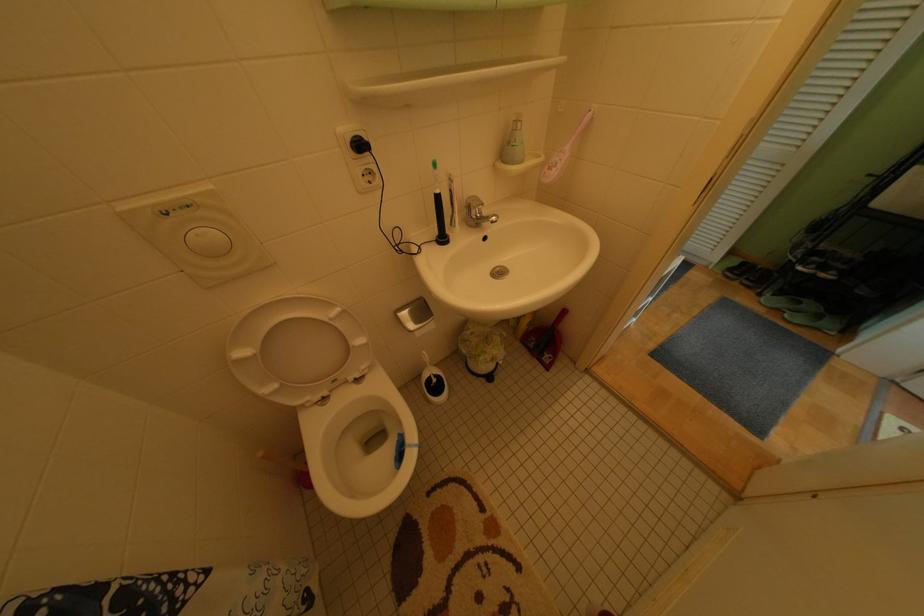
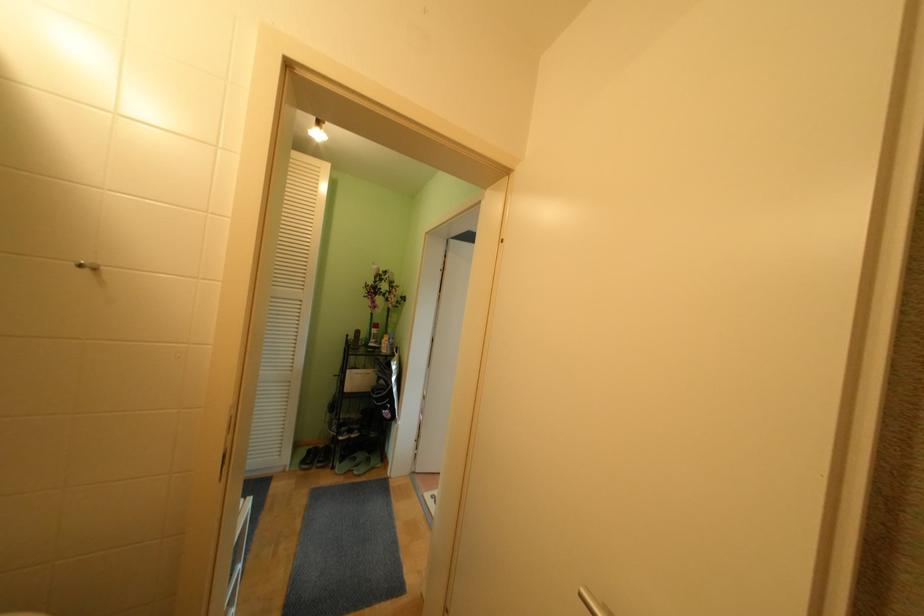
Question: The camera is either moving clockwise (left) or counter-clockwise (right) around the object. The first image is from the beginning of the video and the second image is from the end. Is the camera moving left or right when shooting the video?

Choices:
 (A) Left
 (B) Right

Answer: (A)